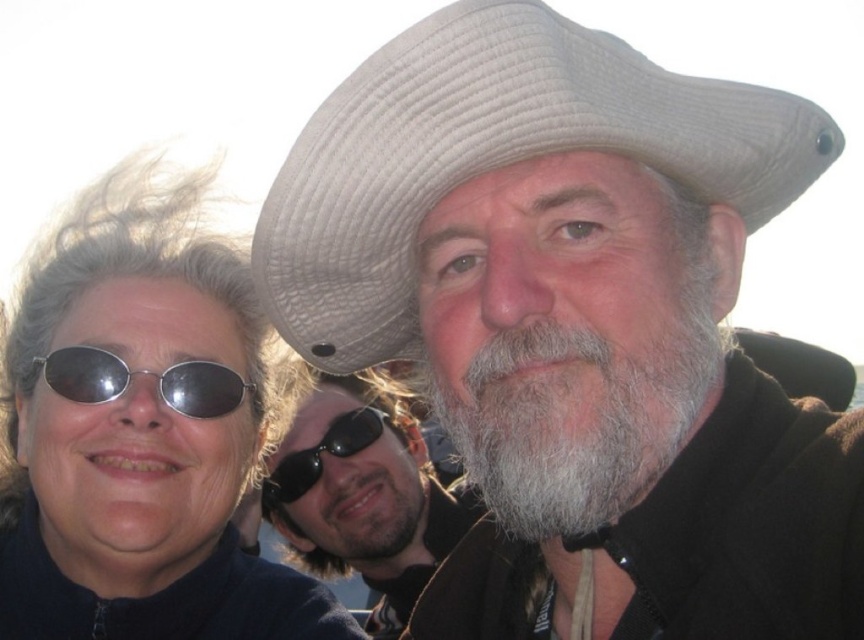
Based on the scene description, can you determine the spatial relationship between the white woven cowboy hat at upper center and the gray beard at center?

The white woven cowboy hat at upper center is to the right of the gray beard at center.